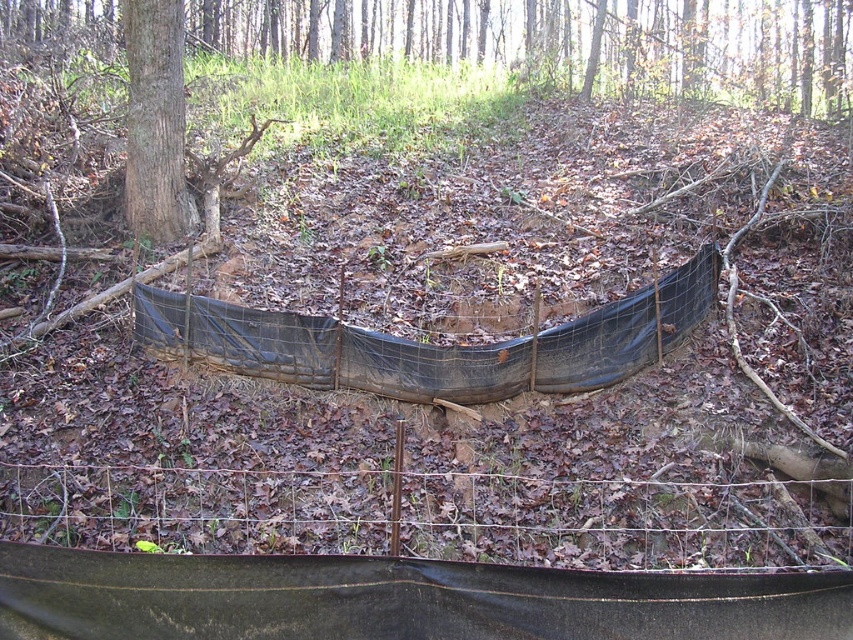
You are standing at the center of the forest area shown in the image. There is a wire mesh fence at lower center represented by point (434, 513). Can you determine if the wire mesh fence at lower center is closer to you than the trees in the background?

The wire mesh fence at lower center is represented by point (434, 513), but there is no information provided about the distance between the fence and the trees in the background to determine which is closer.

From the picture: You are navigating through the forest and need to locate the wire mesh fence at lower center. According to the scene description, where would you find it relative to the makeshift enclosure made of black plastic sheeting and wooden stakes?

The wire mesh fence at lower center is located at point (434, 513), which is within the enclosure formed by the black plastic sheeting and wooden stakes.

You are a hiker who has stumbled upon this forest area. You notice the wire mesh fence at lower center and the black plastic tarp at center. Which one do you think is smaller in size?

The wire mesh fence at lower center is smaller compared to the black plastic tarp at center, so the wire mesh fence at lower center is the smaller one.